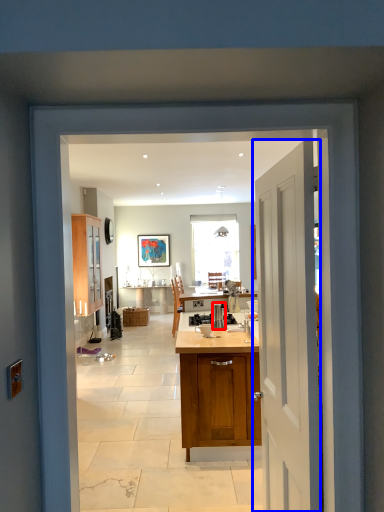
Question: Which of the following is the farthest to the observer, kitchen appliance (highlighted by a red box) or door (highlighted by a blue box)?

Choices:
 (A) kitchen appliance
 (B) door

Answer: (A)